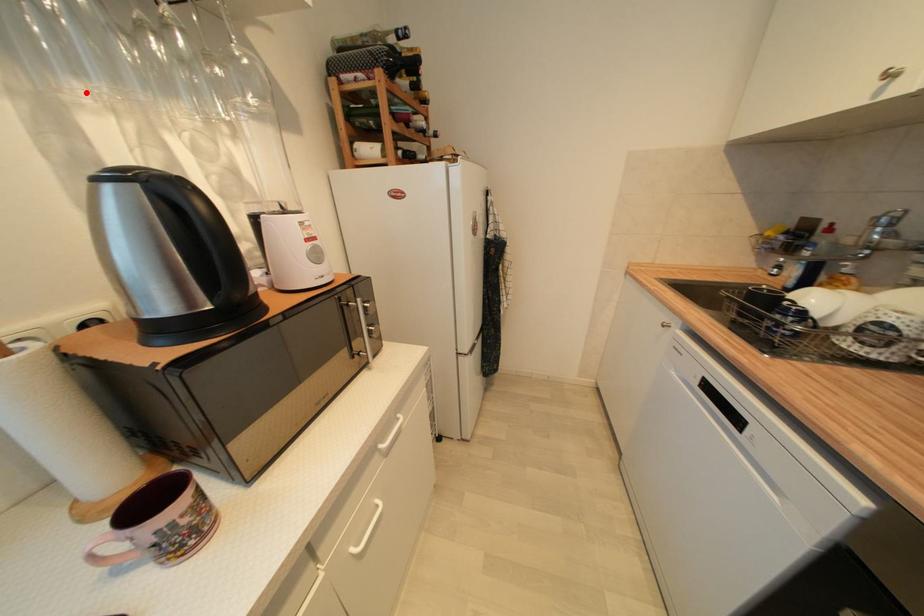
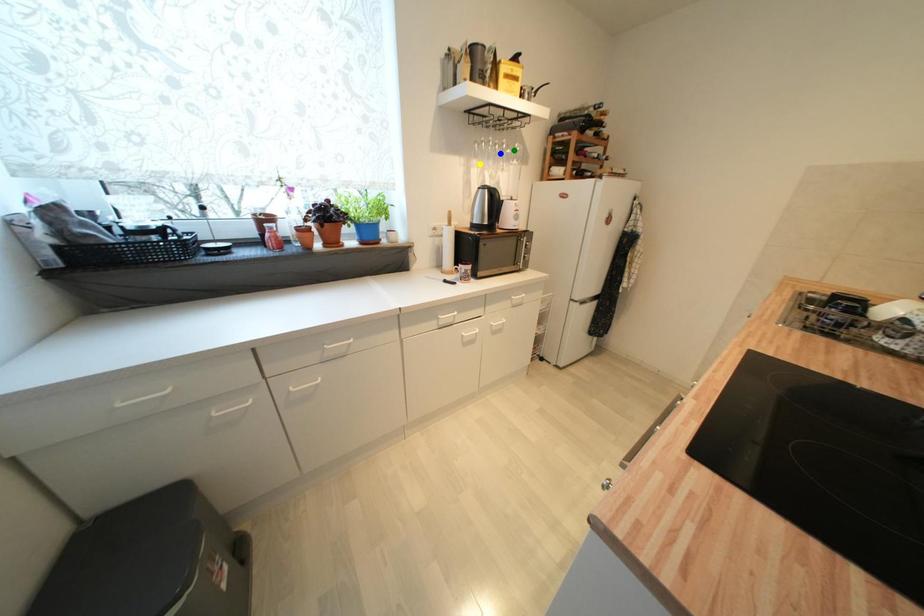
Question: I am providing you with two images of the same scene from different viewpoints. A red point is marked on the first image. You are given multiple points on the second image. Which spot in image 2 lines up with the point in image 1?

Choices:
 (A) green point
 (B) yellow point
 (C) blue point

Answer: (B)